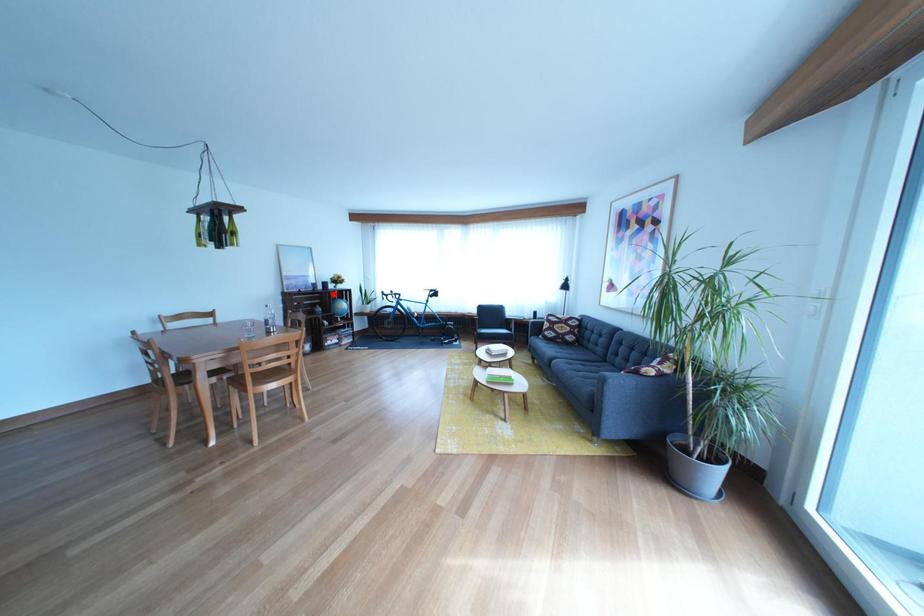
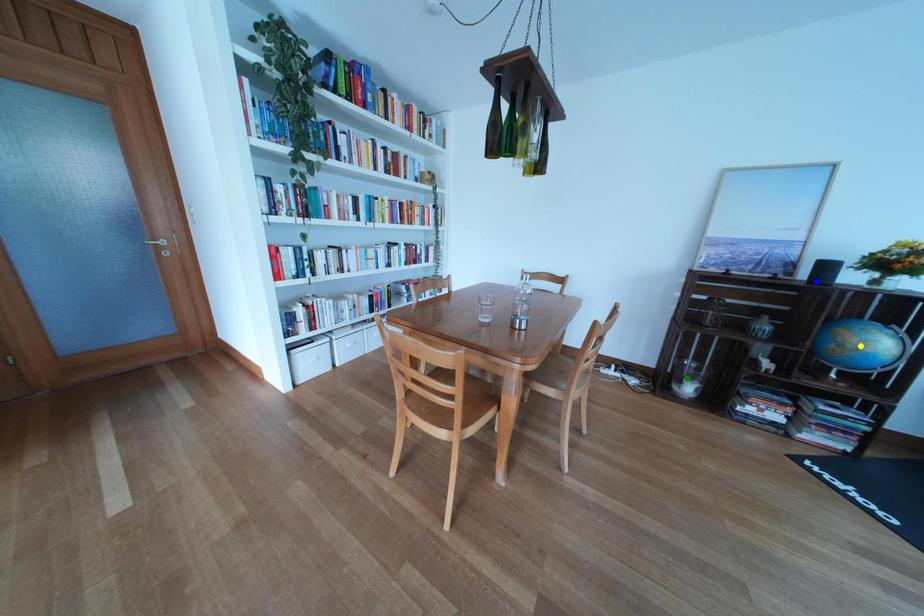
Question: I am providing you with two images of the same scene from different viewpoints. A red point is marked on the first image. You are given multiple points on the second image. Which point in image 2 is actually the same real-world point as the red point in image 1?

Choices:
 (A) yellow point
 (B) green point
 (C) blue point

Answer: (C)